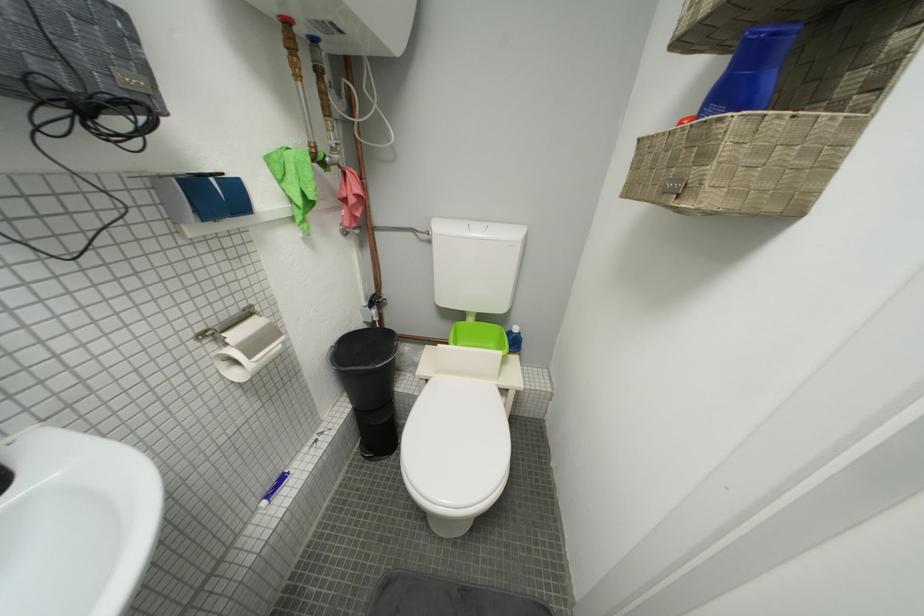
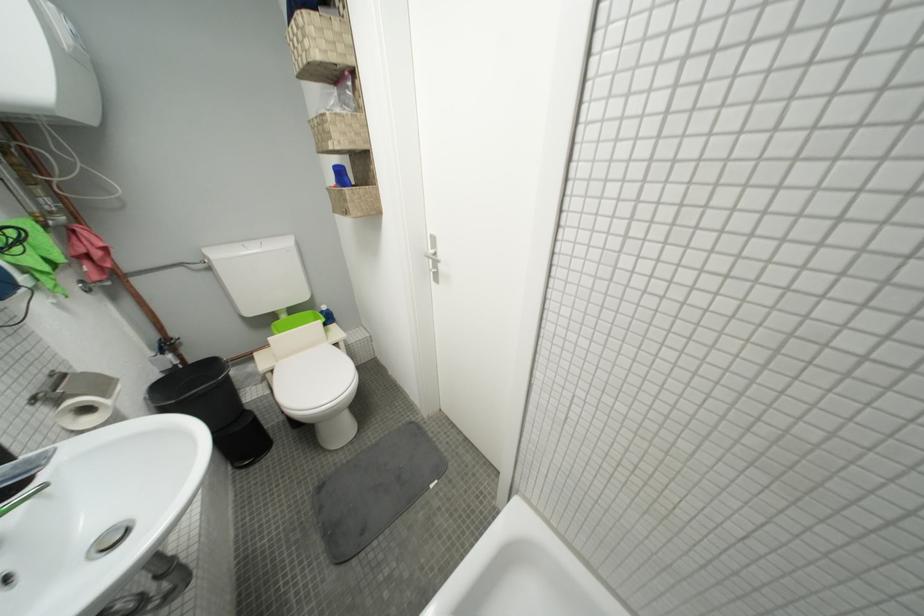
Find the pixel in the second image that matches the point at 259,359 in the first image.

(113, 397)